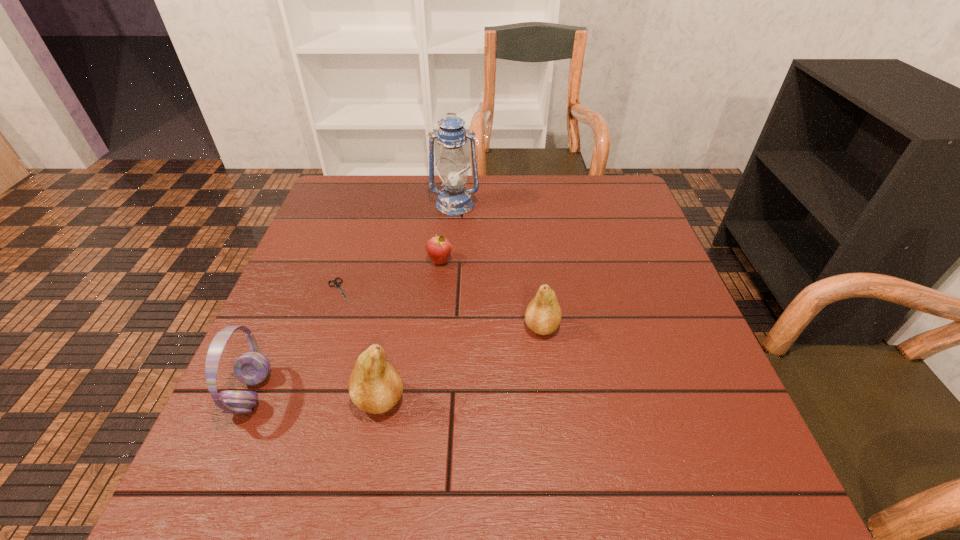
In order to click on object that is the fifth closest one to the third farthest object in this screenshot , I will do `click(543, 314)`.

I want to click on vacant space that satisfies the following two spatial constraints: 1. on the headband and ear cups of the leftmost object; 2. on the left side of the left pear, so click(249, 400).

Identify the location of vacant area in the image that satisfies the following two spatial constraints: 1. on the front side of the right pear; 2. on the headband and ear cups of the leftmost object. The width and height of the screenshot is (960, 540). (550, 393).

What are the coordinates of `vacant space that satisfies the following two spatial constraints: 1. on the front-facing side of the farthest object; 2. on the headband and ear cups of the leftmost object` in the screenshot? It's located at (441, 393).